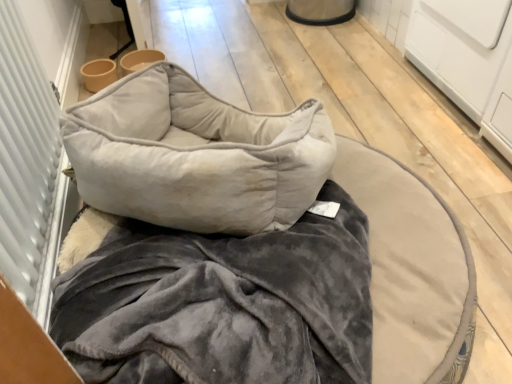
Question: From the image's perspective, relative to white textured screen door at left, is velvet gray pet bed at center above or below?

Choices:
 (A) below
 (B) above

Answer: (A)

Question: Is velvet gray pet bed at center in front of or behind white textured screen door at left in the image?

Choices:
 (A) behind
 (B) front

Answer: (A)

Question: Estimate the real-world distances between objects in this image. Which object is farther from the white textured screen door at left?

Choices:
 (A) velvet gray pillow at center
 (B) velvet gray pet bed at center

Answer: (B)

Question: Which is nearer to the velvet gray pillow at center?

Choices:
 (A) white textured screen door at left
 (B) velvet gray pet bed at center

Answer: (B)